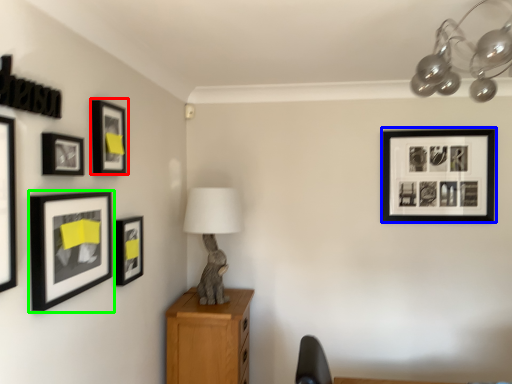
Question: Considering the real-world distances, which object is closest to picture frame (highlighted by a red box)? picture frame (highlighted by a blue box) or picture frame (highlighted by a green box).

Choices:
 (A) picture frame
 (B) picture frame

Answer: (B)